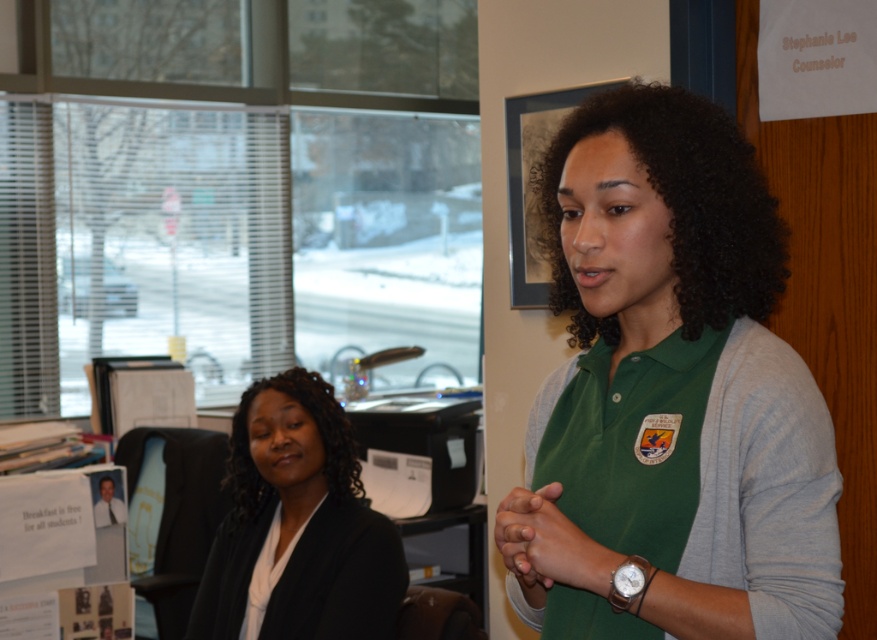
Can you confirm if black silky hair at center is wider than silver metallic watch at lower right?

Correct, the width of black silky hair at center exceeds that of silver metallic watch at lower right.

Between point (236, 488) and point (633, 572), which one is positioned behind?

The point (236, 488) is behind.

Find the location of a particular element. black silky hair at center is located at coordinates (317, 432).

Which is below, black matte blazer at left or green matte hands at center?

black matte blazer at left

Does black matte blazer at left appear on the right side of green matte hands at center?

No, black matte blazer at left is not to the right of green matte hands at center.

Measure the distance between point (280, 524) and camera.

Point (280, 524) is 2.57 meters away from camera.

Find the location of a particular element. The image size is (877, 640). black matte blazer at left is located at coordinates (297, 525).

Between green matte hands at center and silver metallic watch at lower right, which one has more height?

With more height is green matte hands at center.

Who is positioned more to the left, green matte hands at center or silver metallic watch at lower right?

Positioned to the left is green matte hands at center.

Where is `green matte hands at center`? green matte hands at center is located at coordinates (548, 545).

You are a GUI agent. You are given a task and a screenshot of the screen. Output one action in this format:
    pyautogui.click(x=<x>, y=<y>)
    Task: Click on the green matte hands at center
    
    Given the screenshot: What is the action you would take?
    pyautogui.click(x=548, y=545)